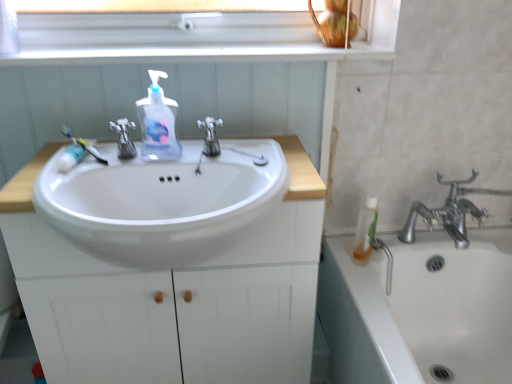
Question: Is white glossy window sill at upper center in front of satin nickel faucet at center, placed as the second tap when sorted from right to left?

Choices:
 (A) no
 (B) yes

Answer: (A)

Question: Is white glossy window sill at upper center positioned far away from satin nickel faucet at center, placed as the second tap when sorted from right to left?

Choices:
 (A) no
 (B) yes

Answer: (A)

Question: From the image's perspective, is white glossy window sill at upper center located above satin nickel faucet at center, placed as the second tap when sorted from right to left?

Choices:
 (A) yes
 (B) no

Answer: (A)

Question: Considering the relative sizes of white glossy window sill at upper center and satin nickel faucet at center, acting as the first tap starting from the left, in the image provided, is white glossy window sill at upper center thinner than satin nickel faucet at center, acting as the first tap starting from the left,?

Choices:
 (A) yes
 (B) no

Answer: (B)

Question: Can you confirm if white glossy window sill at upper center is taller than satin nickel faucet at center, acting as the first tap starting from the left?

Choices:
 (A) yes
 (B) no

Answer: (B)

Question: Would you say satin nickel faucet at center, acting as the first tap starting from the left, is part of white glossy window sill at upper center's contents?

Choices:
 (A) no
 (B) yes

Answer: (A)

Question: Is silver metallic faucet at center, acting as the 1th tap starting from the right, bigger than satin nickel faucet at center, placed as the second tap when sorted from right to left?

Choices:
 (A) no
 (B) yes

Answer: (B)

Question: Is silver metallic faucet at center, acting as the 1th tap starting from the right, smaller than satin nickel faucet at center, placed as the second tap when sorted from right to left?

Choices:
 (A) no
 (B) yes

Answer: (A)

Question: Is silver metallic faucet at center, acting as the 1th tap starting from the right, oriented away from satin nickel faucet at center, placed as the second tap when sorted from right to left?

Choices:
 (A) yes
 (B) no

Answer: (B)

Question: Does silver metallic faucet at center, acting as the 1th tap starting from the right, appear on the left side of satin nickel faucet at center, acting as the first tap starting from the left?

Choices:
 (A) yes
 (B) no

Answer: (B)

Question: From a real-world perspective, is silver metallic faucet at center, acting as the 1th tap starting from the right, on satin nickel faucet at center, acting as the first tap starting from the left?

Choices:
 (A) no
 (B) yes

Answer: (B)

Question: Is silver metallic faucet at center, which ranks as the second tap in left-to-right order, surrounding satin nickel faucet at center, acting as the first tap starting from the left?

Choices:
 (A) no
 (B) yes

Answer: (A)

Question: Is satin nickel faucet at center, acting as the first tap starting from the left, at the right side of white glossy window sill at upper center?

Choices:
 (A) no
 (B) yes

Answer: (A)